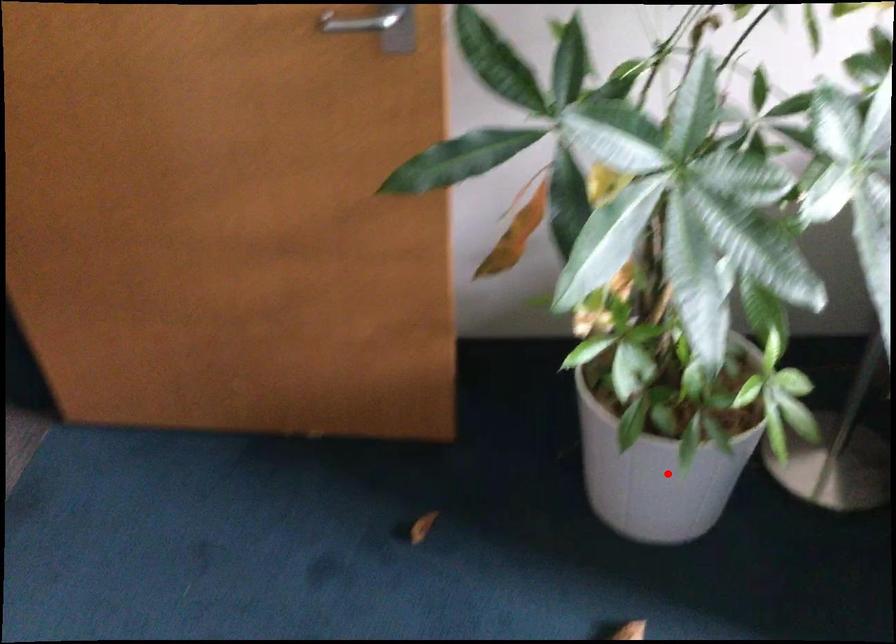
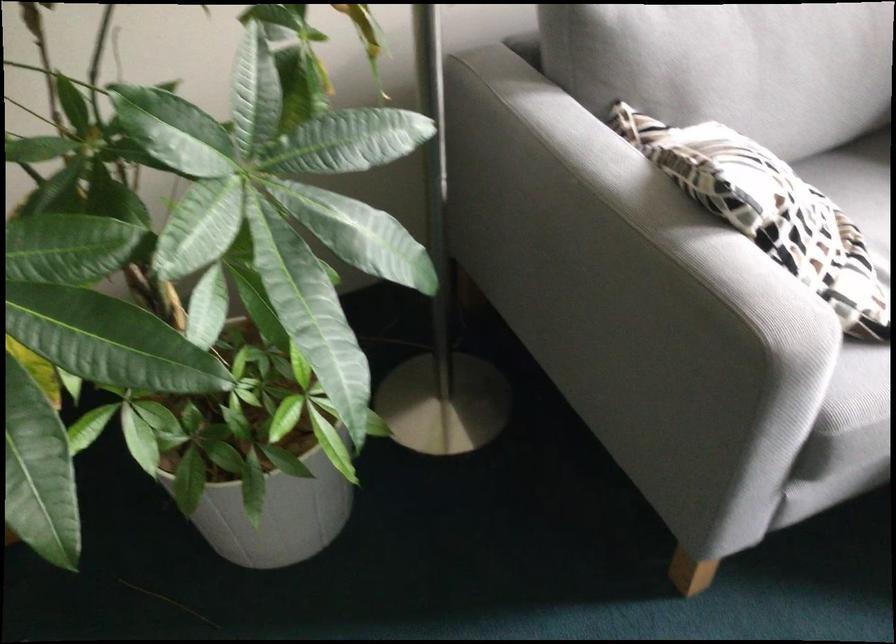
Find the pixel in the second image that matches the highlighted location in the first image.

(273, 506)